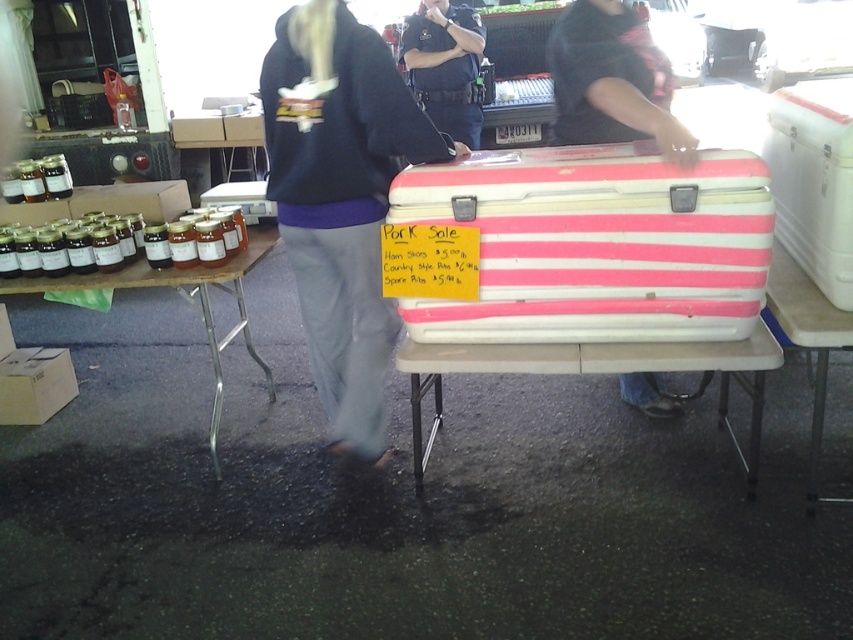
Question: Can you confirm if white plastic table at center is positioned below wooden table at lower left?

Choices:
 (A) no
 (B) yes

Answer: (B)

Question: Which point is closer to the camera taking this photo?

Choices:
 (A) (840, 289)
 (B) (648, 33)
 (C) (364, 216)

Answer: (A)

Question: Can you confirm if white plastic cooler at center is positioned above wooden table at lower left?

Choices:
 (A) no
 (B) yes

Answer: (B)

Question: Does white plastic table at center appear over white plastic cooler at center?

Choices:
 (A) no
 (B) yes

Answer: (A)

Question: Estimate the real-world distances between objects in this image. Which object is farther from the white plastic table at center?

Choices:
 (A) white plastic cooler at center
 (B) pink striped plastic cooler at center
 (C) dark blue uniform at center

Answer: (C)

Question: Which of the following is the closest to the observer?

Choices:
 (A) white plastic table at center
 (B) white plastic cooler at center

Answer: (B)